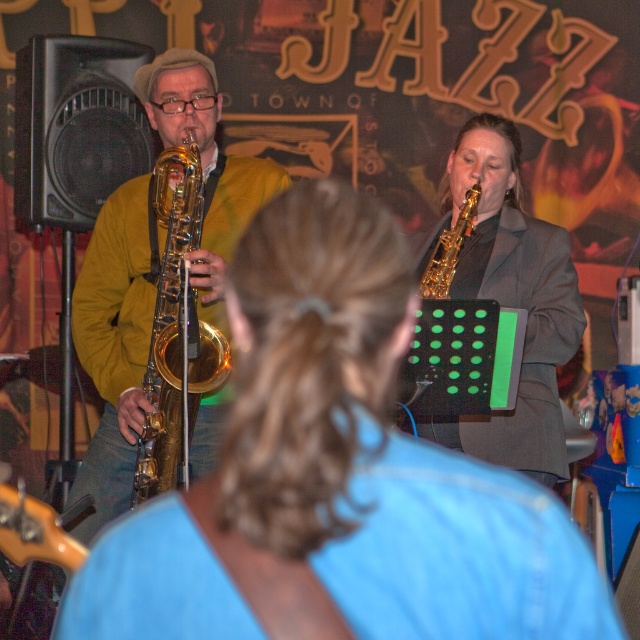
Does gold shiny trumpet at left have a greater height compared to gold shiny trumpet at right?

Correct, gold shiny trumpet at left is much taller as gold shiny trumpet at right.

Is gold shiny trumpet at left below gold shiny trumpet at right?

Indeed, gold shiny trumpet at left is positioned under gold shiny trumpet at right.

Describe the element at coordinates (173, 326) in the screenshot. I see `gold shiny trumpet at left` at that location.

Locate an element on the screen. gold shiny trumpet at left is located at coordinates (173, 326).

Is shiny gold saxophone at upper center bigger than gold shiny trumpet at left?

Actually, shiny gold saxophone at upper center might be smaller than gold shiny trumpet at left.

Does point (433, 540) come farther from viewer compared to point (180, 342)?

No.

Between point (300, 225) and point (173, 288), which one is positioned in front?

Point (300, 225) is more forward.

You are a GUI agent. You are given a task and a screenshot of the screen. Output one action in this format:
    pyautogui.click(x=<x>, y=<y>)
    Task: Click on the shiny gold saxophone at upper center
    The image size is (640, 640).
    Given the screenshot: What is the action you would take?
    pyautogui.click(x=333, y=476)

Is gold shiny saxophone at center bigger than gold shiny trumpet at left?

Yes.

Which is behind, point (216, 285) or point (180, 317)?

The point (216, 285) is more distant.

You are a GUI agent. You are given a task and a screenshot of the screen. Output one action in this format:
    pyautogui.click(x=<x>, y=<y>)
    Task: Click on the gold shiny saxophone at center
    This screenshot has height=640, width=640.
    Given the screenshot: What is the action you would take?
    pyautogui.click(x=115, y=344)